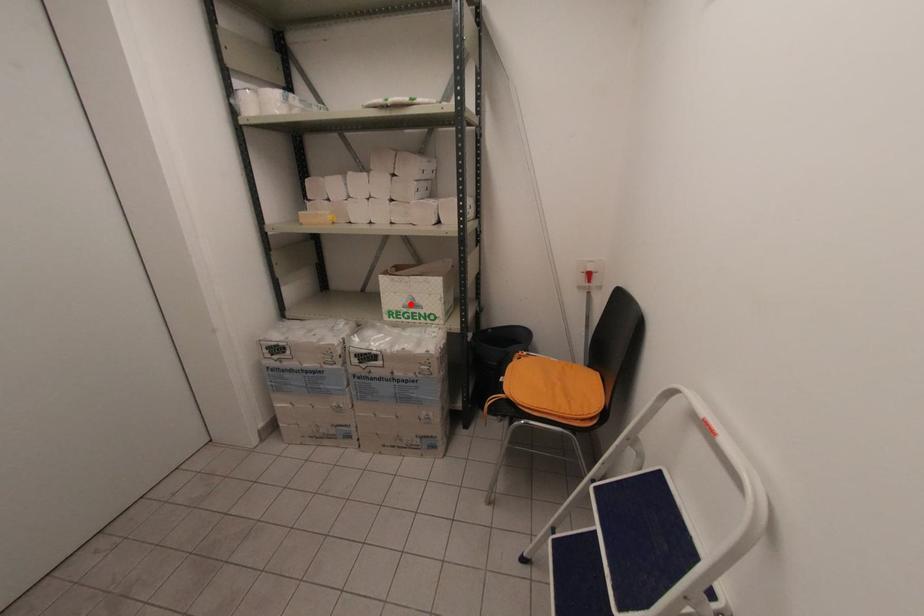
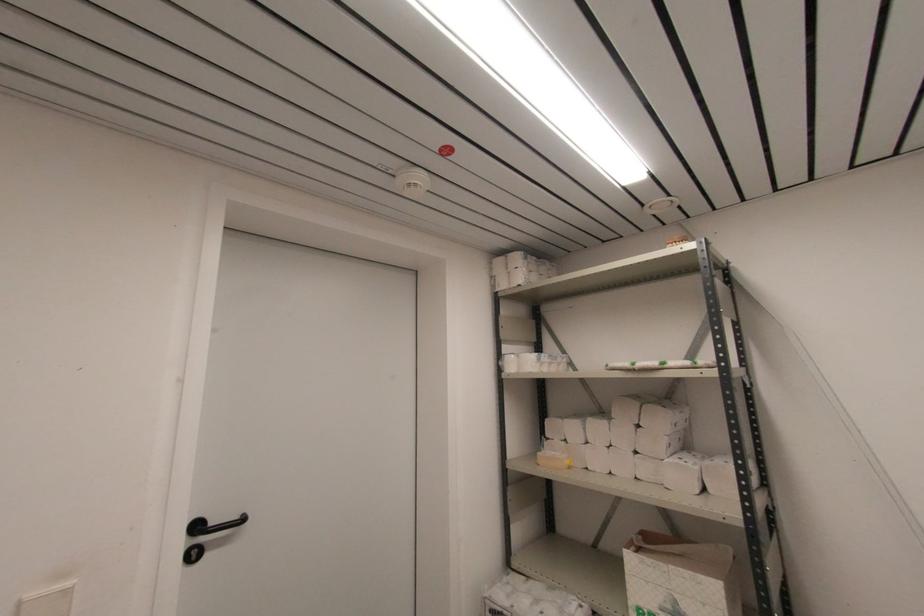
Question: I am providing you with two images of the same scene from different viewpoints. In image1, a red point is highlighted. Considering the same 3D point in image2, which of the following is correct?

Choices:
 (A) It is closer
 (B) It is farther

Answer: (A)